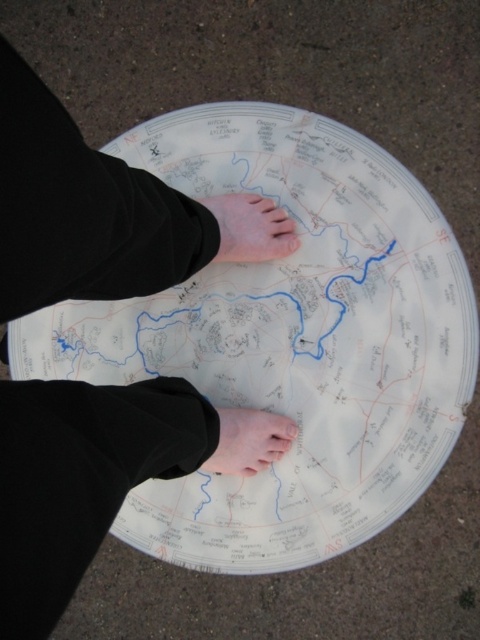
Question: Is white paper plate at center wider than pink flesh at lower center?

Choices:
 (A) yes
 (B) no

Answer: (A)

Question: Among these points, which one is nearest to the camera?

Choices:
 (A) (260, 195)
 (B) (339, 381)

Answer: (B)

Question: Does white paper plate at center have a lesser width compared to light skin barefoot at center?

Choices:
 (A) no
 (B) yes

Answer: (A)

Question: Can you confirm if light skin barefoot at center is positioned to the right of pink flesh at lower center?

Choices:
 (A) yes
 (B) no

Answer: (A)

Question: Which point is closer to the camera?

Choices:
 (A) (214, 198)
 (B) (266, 458)
 (C) (272, 348)

Answer: (B)

Question: Among these points, which one is farthest from the camera?

Choices:
 (A) (251, 454)
 (B) (229, 252)
 (C) (385, 419)

Answer: (B)